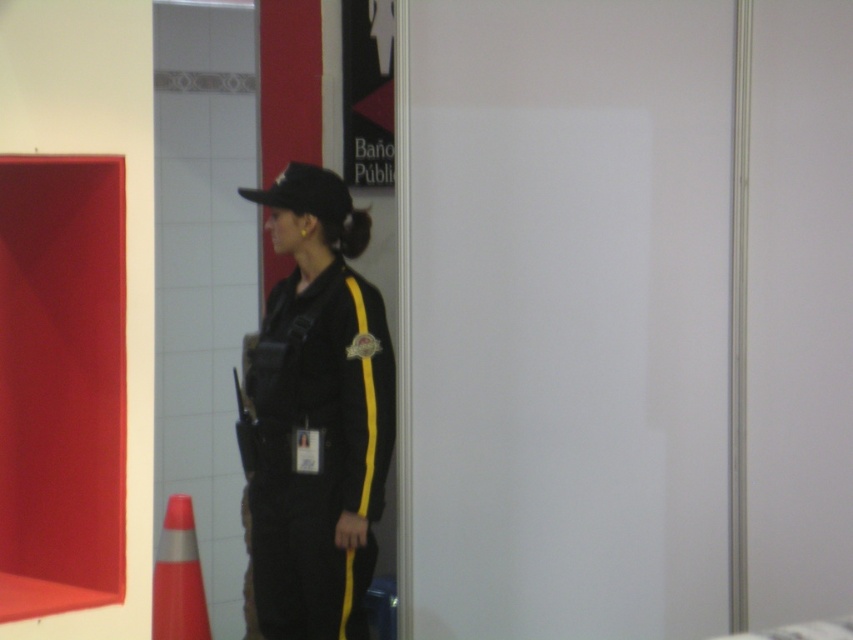
Does black matte uniform at center have a larger size compared to orange reflective cone at lower left?

Correct, black matte uniform at center is larger in size than orange reflective cone at lower left.

Does black matte uniform at center appear on the right side of orange reflective cone at lower left?

Correct, you'll find black matte uniform at center to the right of orange reflective cone at lower left.

Between point (340, 236) and point (184, 612), which one is positioned behind?

The point (184, 612) is behind.

The image size is (853, 640). I want to click on black matte uniform at center, so click(317, 413).